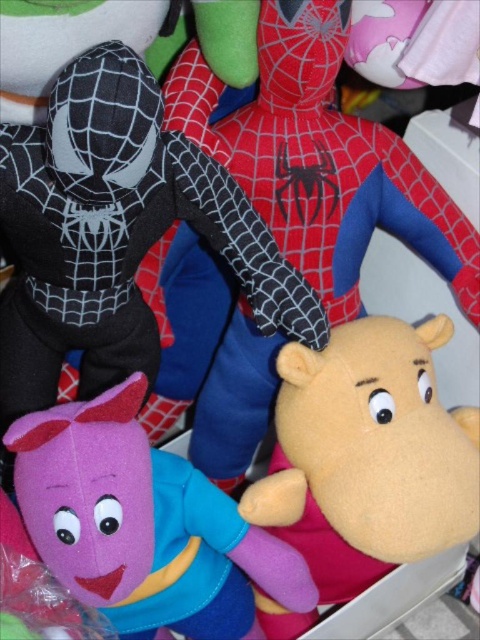
Question: Which point is farther to the camera?

Choices:
 (A) velvet yellow plush hippo at center
 (B) soft yellow hippo at center
 (C) matte purple plush toy at lower left

Answer: (B)

Question: Is velvet yellow plush hippo at center to the right of red fabric spider at center from the viewer's perspective?

Choices:
 (A) no
 (B) yes

Answer: (B)

Question: Is velvet yellow plush hippo at center to the right of soft yellow hippo at center from the viewer's perspective?

Choices:
 (A) no
 (B) yes

Answer: (A)

Question: Which point is closer to the camera?

Choices:
 (A) (169, 611)
 (B) (285, 179)

Answer: (B)

Question: Based on their relative distances, which object is nearer to the soft yellow hippo at center?

Choices:
 (A) matte purple plush toy at lower left
 (B) red fabric spider at center

Answer: (A)

Question: Is velvet yellow plush hippo at center thinner than matte purple plush toy at lower left?

Choices:
 (A) no
 (B) yes

Answer: (A)